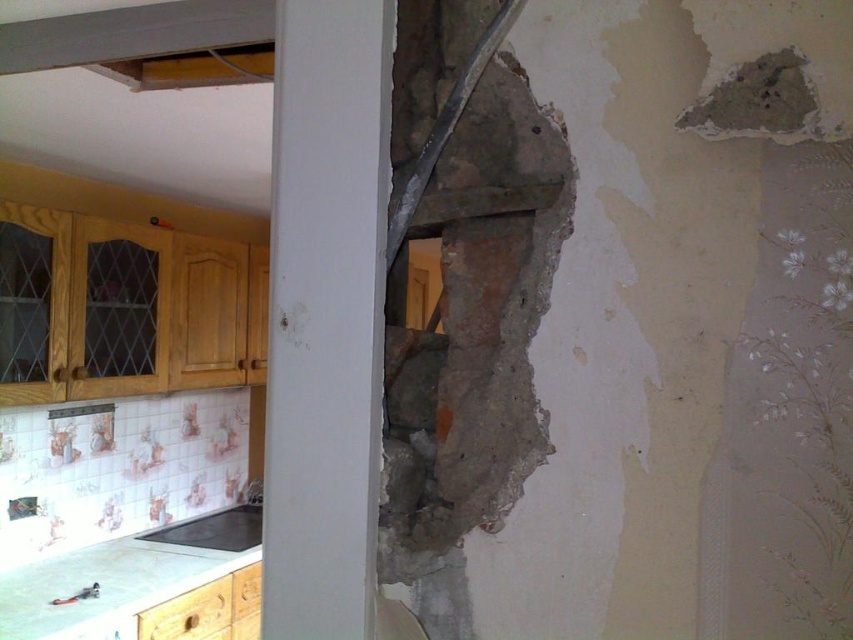
Looking at this image, you are a contractor working on this partially demolished space. You need to place a new appliance that requires a stable surface to the right of the white glossy countertop at lower left. Can you use the black matte stove at lower left for this purpose?

The white glossy countertop at lower left is to the left of the black matte stove at lower left, so the black matte stove at lower left is to the right of the white countertop. Since the stove is at lower left and the countertop is also at lower left, the stove may provide a stable surface. However, stoves are not typically designed for placing heavy appliances, so it is not advisable to use the black matte stove at lower left for this purpose.

You are a contractor assessing the kitchen area. You need to place a new appliance that requires 1.2 meters of space. The appliance is as wide as the black matte stove at lower left. Can the white glossy countertop at lower left accommodate it?

The white glossy countertop at lower left is larger in size than the black matte stove at lower left. Since the appliance is as wide as the stove, and the countertop is larger, it can accommodate the appliance.